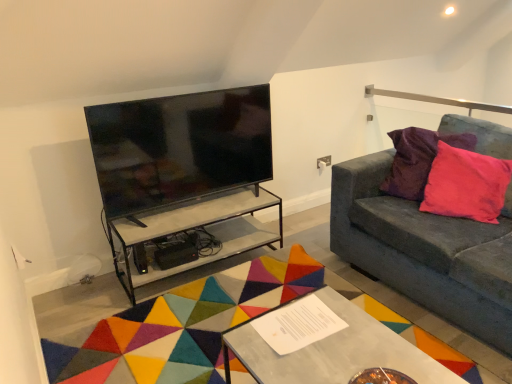
Identify the location of free space to the right of white paper at center. This screenshot has width=512, height=384. (353, 328).